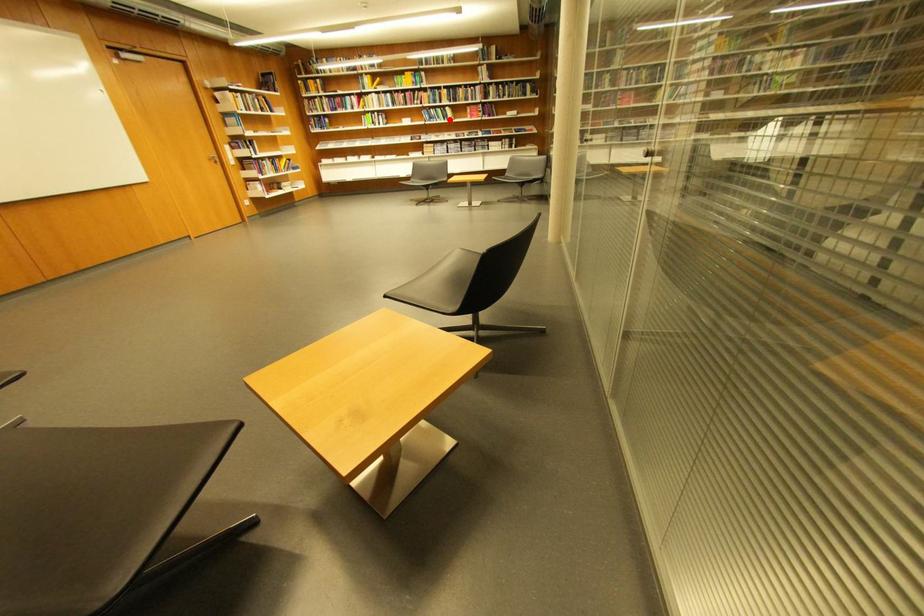
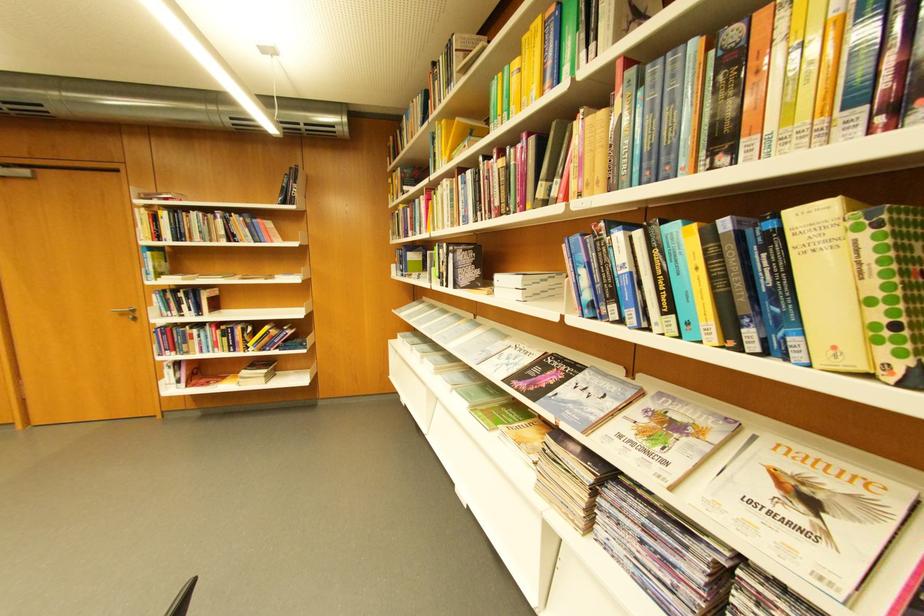
Locate, in the second image, the point that corresponds to the highlighted location in the first image.

(681, 310)